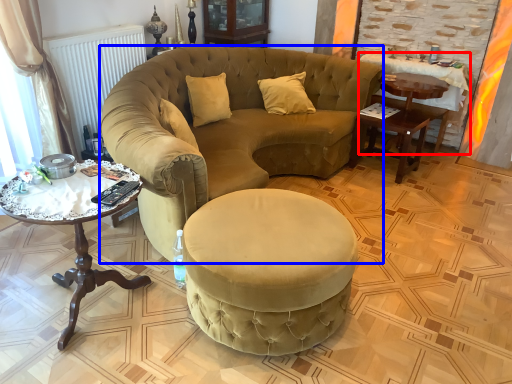
Question: Which object appears farthest to the camera in this image, desk (highlighted by a red box) or chair (highlighted by a blue box)?

Choices:
 (A) desk
 (B) chair

Answer: (A)